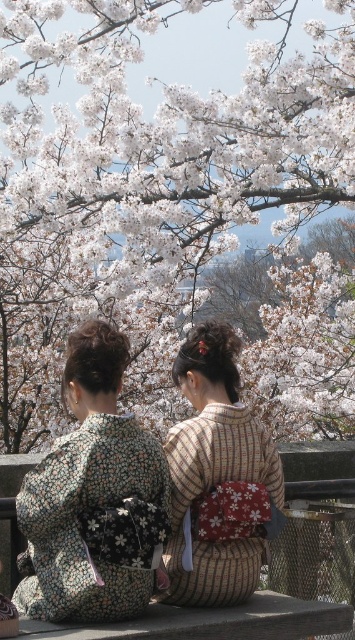
You are a tailor who needs to determine which kimono requires more fabric to make between the floral kimono at center and the striped fabric kimono at center. Based on the image, which one would need more fabric?

The floral kimono at center is larger in size than the striped fabric kimono at center, so it would require more fabric to make.

You are standing in front of the two people sitting on the stone ledge in the cherry blossom scene. You want to know which of the two points, point (226, 230) or point (210, 557), is closer to you. Which one is it?

Point (226, 230) is closer to you because it is further to the viewer than point (210, 557).